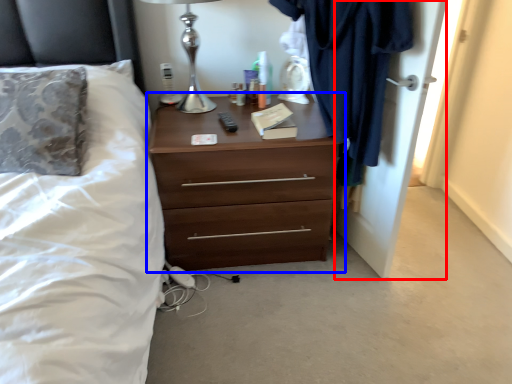
Question: Among these objects, which one is nearest to the camera, door (highlighted by a red box) or chest of drawers (highlighted by a blue box)?

Choices:
 (A) door
 (B) chest of drawers

Answer: (A)